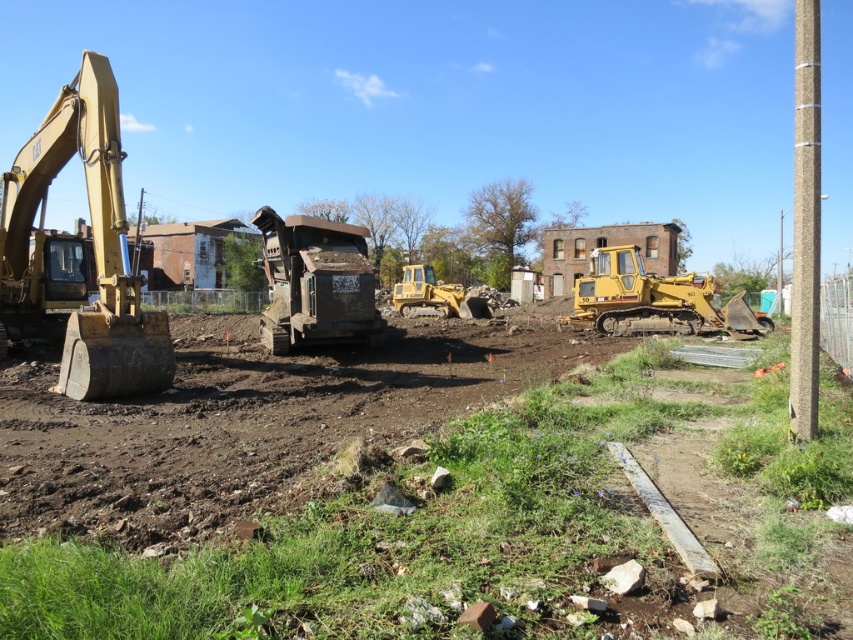
You are a delivery driver who needs to park your 3.5 meter wide truck in this construction site. You see the dirty metal dump truck at center and the brown textured pole at right. Based on their widths, can your truck fit between them without touching either?

The dirty metal dump truck at center is narrower than the brown textured pole at right. Since the dump truck is narrower, the space between them might be sufficient. However, the exact width of the space isn

You are a construction worker who needs to transport materials from the brown textured pole at right to the dirty metal dump truck at center. Considering their sizes, which object should you prioritize loading first?

The dirty metal dump truck at center has a smaller size compared to the brown textured pole at right, so you should prioritize loading the brown textured pole at right first since it is larger and may require more space or effort to handle.